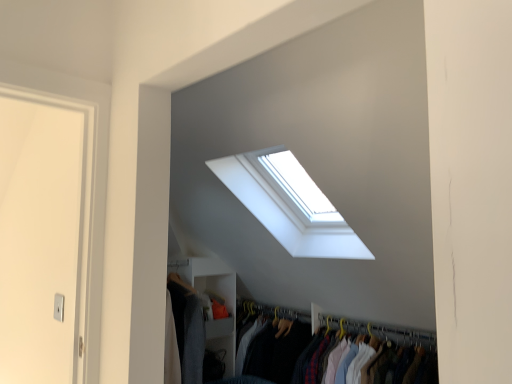
Question: From the image's perspective, is white glass window at upper center beneath white matte closet at lower left, the second closet from the front?

Choices:
 (A) no
 (B) yes

Answer: (A)

Question: From a real-world perspective, is white glass window at upper center beneath white matte closet at lower left, the second closet from the front?

Choices:
 (A) no
 (B) yes

Answer: (A)

Question: Is white glass window at upper center wider than white matte closet at lower left, the second closet from the front?

Choices:
 (A) yes
 (B) no

Answer: (A)

Question: Is white glass window at upper center at the right side of white matte closet at lower left, which is counted as the second closet, starting from the right?

Choices:
 (A) no
 (B) yes

Answer: (B)

Question: Is white glass window at upper center taller than white matte closet at lower left, which appears as the 1th closet when viewed from the back?

Choices:
 (A) yes
 (B) no

Answer: (B)

Question: Is white matte closet at lower left, the second closet from the front, at the back of white glass window at upper center?

Choices:
 (A) yes
 (B) no

Answer: (B)

Question: From a real-world perspective, is white matte closet at lower left, which appears as the 1th closet when viewed from the back, located higher than white glass window at upper center?

Choices:
 (A) yes
 (B) no

Answer: (B)

Question: Is white matte closet at lower left, which appears as the 1th closet when viewed from the back, outside of white glass window at upper center?

Choices:
 (A) no
 (B) yes

Answer: (B)

Question: From a real-world perspective, is white matte closet at lower left, the first closet viewed from the left, beneath white glass window at upper center?

Choices:
 (A) yes
 (B) no

Answer: (A)

Question: Is white matte closet at lower left, which appears as the 1th closet when viewed from the back, oriented away from white glass window at upper center?

Choices:
 (A) no
 (B) yes

Answer: (A)

Question: Is white matte closet at lower left, the first closet viewed from the left, at the left side of white glass window at upper center?

Choices:
 (A) no
 (B) yes

Answer: (B)

Question: Does white matte closet at lower left, the first closet viewed from the left, have a greater width compared to white glass window at upper center?

Choices:
 (A) no
 (B) yes

Answer: (A)

Question: Considering the relative sizes of white fabric clothes at center, arranged as the second closet when viewed from the back, and white matte closet at lower left, the second closet from the front, in the image provided, is white fabric clothes at center, arranged as the second closet when viewed from the back, shorter than white matte closet at lower left, the second closet from the front,?

Choices:
 (A) no
 (B) yes

Answer: (B)